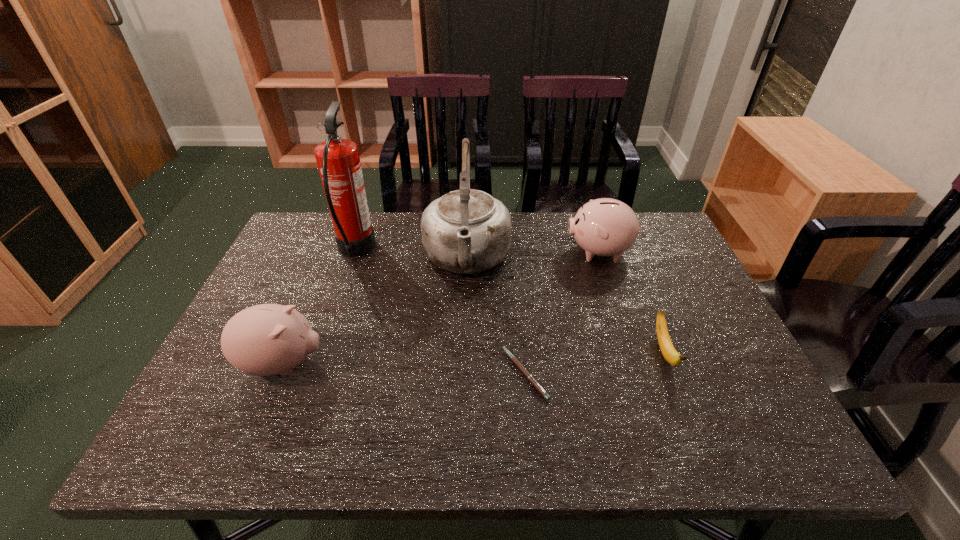
Image resolution: width=960 pixels, height=540 pixels. Find the location of `free space located 0.110m at the stem of the fifth tallest object`. free space located 0.110m at the stem of the fifth tallest object is located at coordinates (693, 426).

Identify the location of vacant space situated 0.160m at the nib of the shortest object. (431, 374).

Where is `vacant space situated at the nib of the shortest object`? The height and width of the screenshot is (540, 960). vacant space situated at the nib of the shortest object is located at coordinates (395, 374).

Locate an element on the screen. This screenshot has width=960, height=540. vacant space located 0.250m at the nib of the shortest object is located at coordinates tap(391, 374).

Identify the location of fire extinguisher that is at the far edge. (338, 161).

Where is `kettle that is positioned at the far edge`? The image size is (960, 540). kettle that is positioned at the far edge is located at coordinates pos(467,231).

Where is `piggy bank positioned at the far edge`? This screenshot has height=540, width=960. piggy bank positioned at the far edge is located at coordinates 604,227.

Find the location of a particular element. The height and width of the screenshot is (540, 960). object that is at the left edge is located at coordinates (268, 339).

Image resolution: width=960 pixels, height=540 pixels. I want to click on piggy bank that is at the right edge, so click(604, 227).

You are a GUI agent. You are given a task and a screenshot of the screen. Output one action in this format:
    pyautogui.click(x=<x>, y=<y>)
    Task: Click on the banana that is at the right edge
    The height and width of the screenshot is (540, 960).
    Given the screenshot: What is the action you would take?
    pyautogui.click(x=668, y=351)